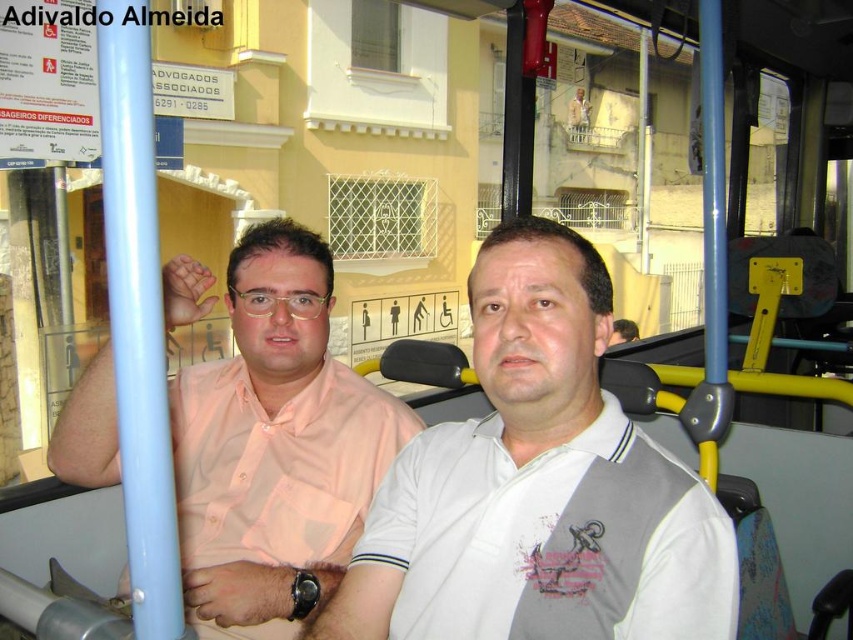
Question: Can you confirm if white cotton shirt at center is positioned to the right of pink shirt at left?

Choices:
 (A) no
 (B) yes

Answer: (B)

Question: Can you confirm if white cotton shirt at center is positioned above pink shirt at left?

Choices:
 (A) yes
 (B) no

Answer: (B)

Question: Can you confirm if white cotton shirt at center is positioned above pink shirt at left?

Choices:
 (A) yes
 (B) no

Answer: (B)

Question: Which point is closer to the camera taking this photo?

Choices:
 (A) 515,436
 (B) 74,435

Answer: (A)